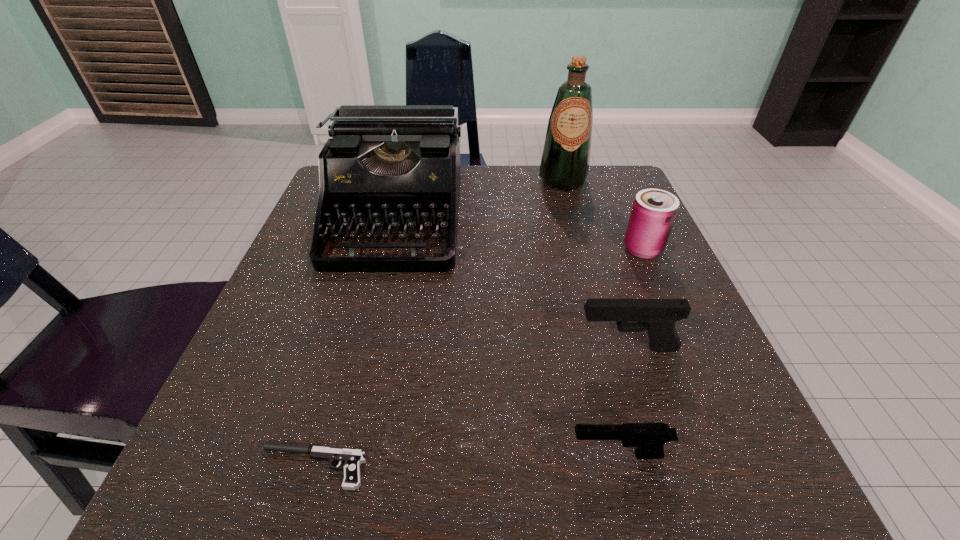
I want to click on vacant position in the image that satisfies the following two spatial constraints: 1. on the front-facing side of the can; 2. on the right side of the olive oil, so click(582, 249).